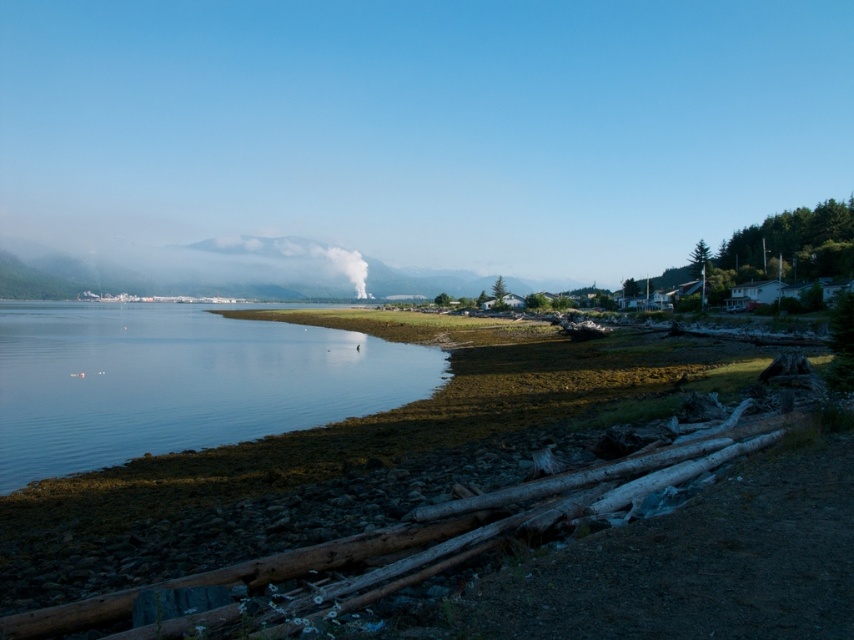
You are standing on the rocky shoreline and want to reach the white smoke at center without getting your feet wet. Which direction should you walk from the clear water at lower left?

You should walk to the right from the clear water at lower left because the white smoke at center is located to the right of it.

You are a hiker standing at the point with coordinates point [326,552]. You want to walk to the rocky shoreline with scattered driftwood logs lying horizontally along the edge. Which direction should you go?

You should go to the lower left direction because the rusty wood logs at lower left are located at point [326,552].

You are a photographer planning to capture the clear water at lower left and rusty wood logs at lower left in the same frame. Based on the scene, which object will occupy more space in your photo?

The clear water at lower left is bigger than the rusty wood logs at lower left, so it will occupy more space in the photo.